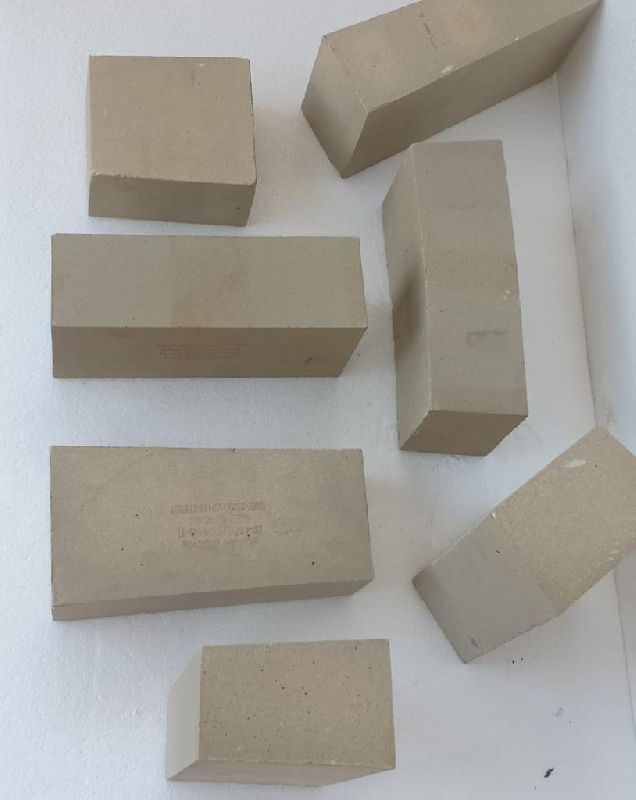
The image size is (636, 800). What are the coordinates of `gray wall` in the screenshot? It's located at (600, 124).